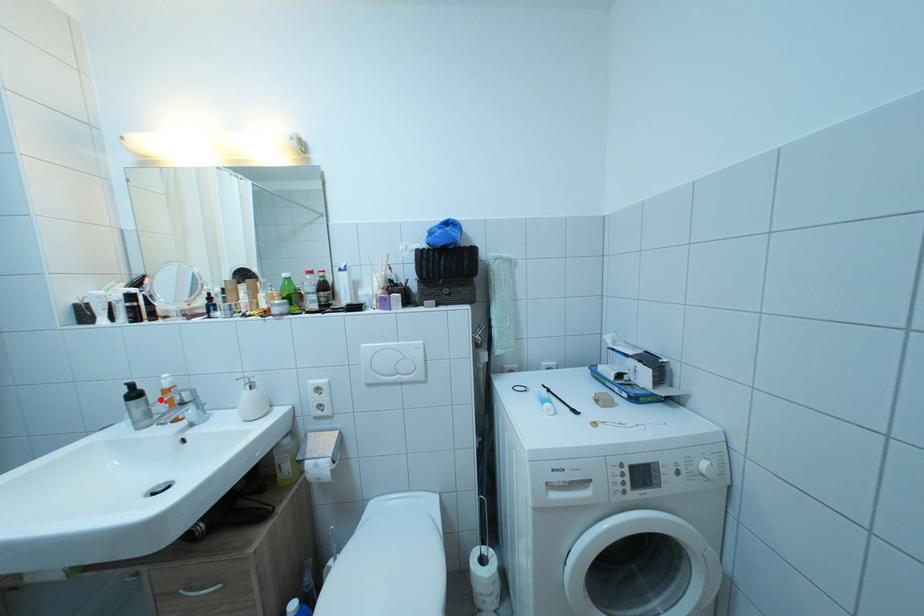
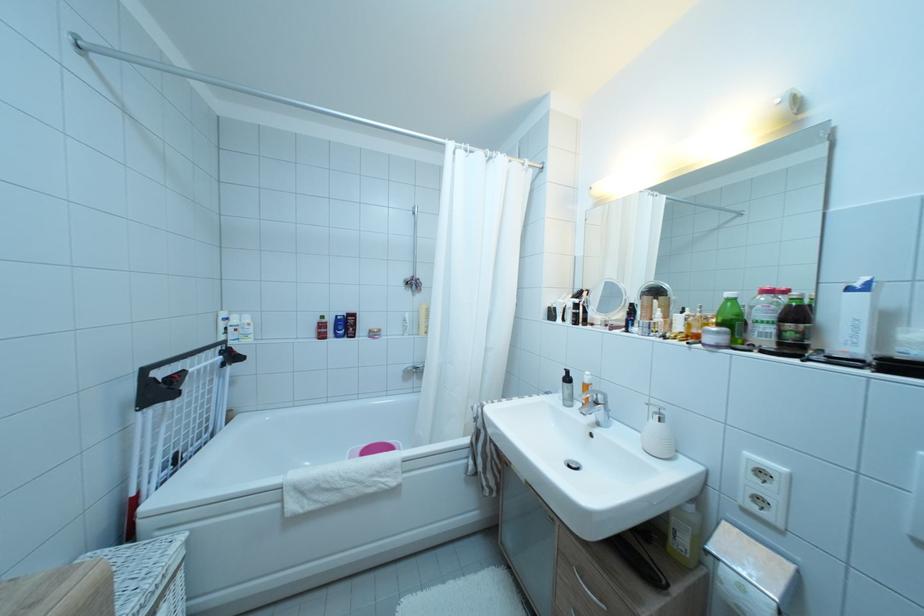
The point at the highlighted location is marked in the first image. Where is the corresponding point in the second image?

(585, 390)